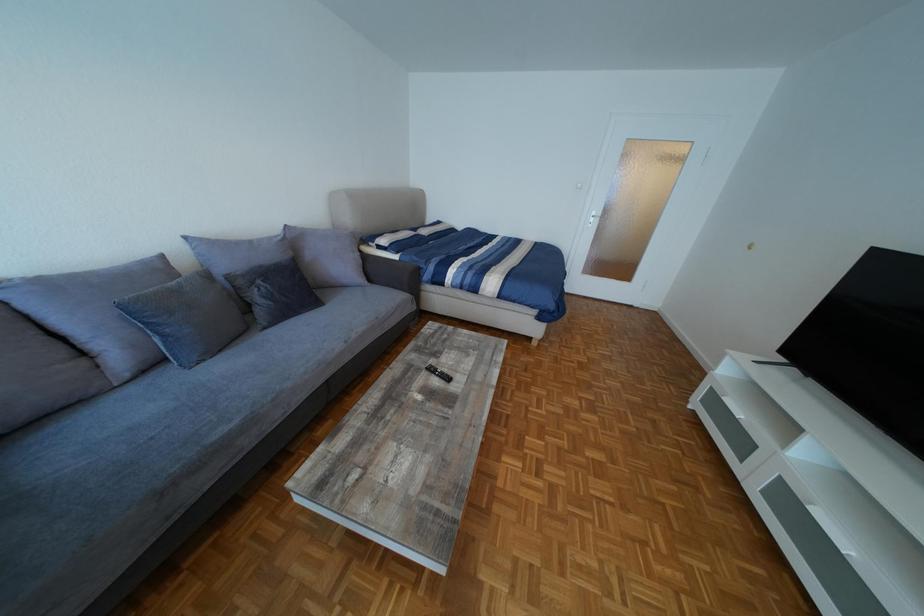
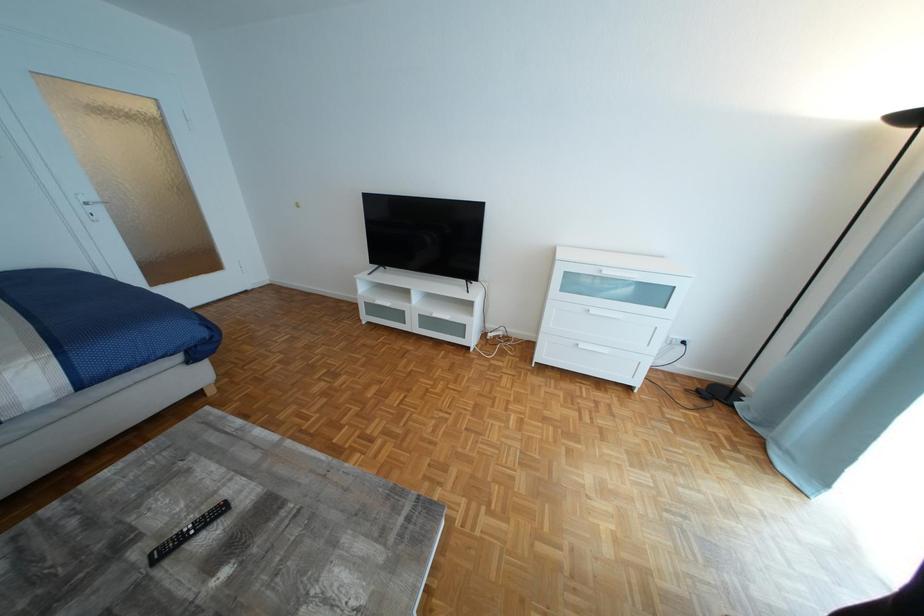
First-person continuous shooting, in which direction is the camera rotating?

The rotation direction of the camera is right-down.